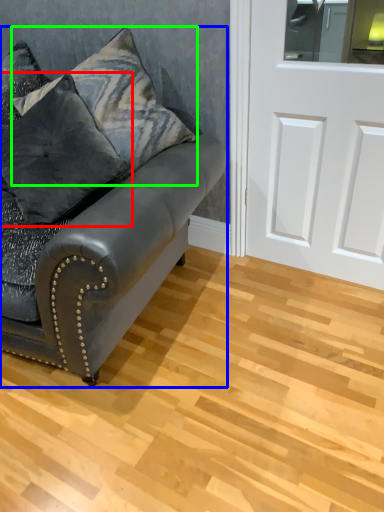
Question: Which object is the closest to the pillow (highlighted by a red box)? Choose among these: studio couch (highlighted by a blue box) or pillow (highlighted by a green box).

Choices:
 (A) studio couch
 (B) pillow

Answer: (B)